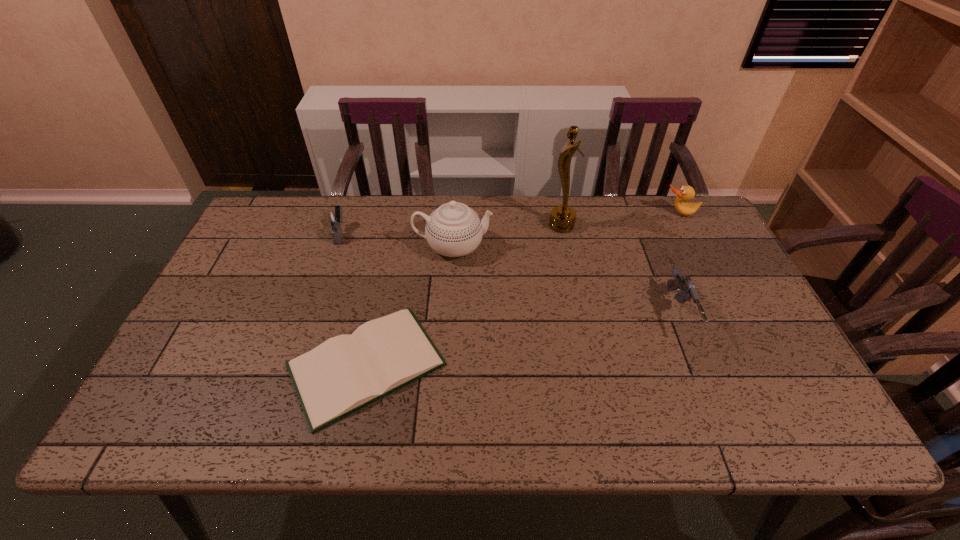
Locate an element on the screen. This screenshot has width=960, height=540. blank area located on the spout of the chinaware is located at coordinates (528, 247).

At what (x,y) coordinates should I click in order to perform the action: click on free spot located on the right of the igniter. Please return your answer as a coordinate pair (x, y). Looking at the image, I should click on (370, 233).

You are a GUI agent. You are given a task and a screenshot of the screen. Output one action in this format:
    pyautogui.click(x=<x>, y=<y>)
    Task: Click on the vacant space located 0.060m on the beak of the rightmost object
    The image size is (960, 540).
    Given the screenshot: What is the action you would take?
    pyautogui.click(x=687, y=231)

You are a GUI agent. You are given a task and a screenshot of the screen. Output one action in this format:
    pyautogui.click(x=<x>, y=<y>)
    Task: Click on the vacant space located 0.050m at the barrel of the second object from right to left
    
    Given the screenshot: What is the action you would take?
    pyautogui.click(x=699, y=366)

Locate an element on the screen. The width and height of the screenshot is (960, 540). free location located on the left of the shortest object is located at coordinates tap(261, 364).

At what (x,y) coordinates should I click in order to perform the action: click on award that is at the far edge. Please return your answer as a coordinate pair (x, y). Looking at the image, I should click on (562, 219).

The width and height of the screenshot is (960, 540). Identify the location of chinaware positioned at the far edge. (454, 229).

Find the location of `igniter that is at the far edge`. igniter that is at the far edge is located at coordinates (332, 217).

Identify the location of duck at the far edge. The width and height of the screenshot is (960, 540). (686, 193).

The width and height of the screenshot is (960, 540). Find the location of `object positioned at the near edge`. object positioned at the near edge is located at coordinates (347, 372).